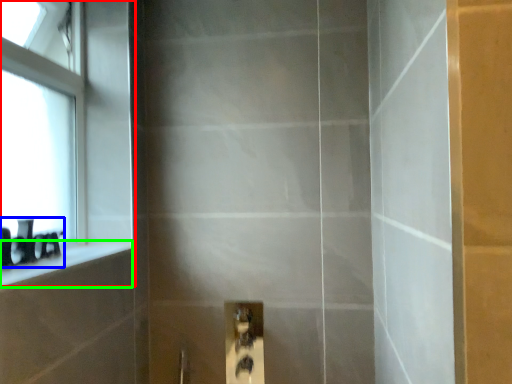
Question: Which is nearer to the window (highlighted by a red box)? toiletry (highlighted by a blue box) or ledge (highlighted by a green box).

Choices:
 (A) toiletry
 (B) ledge

Answer: (B)